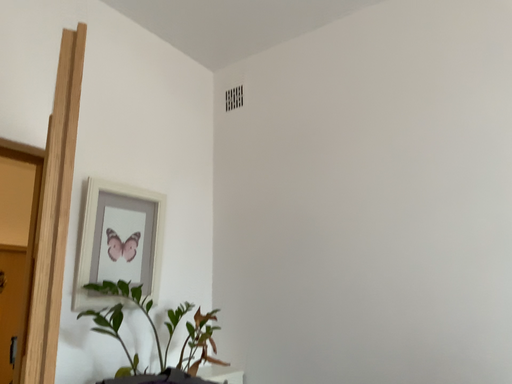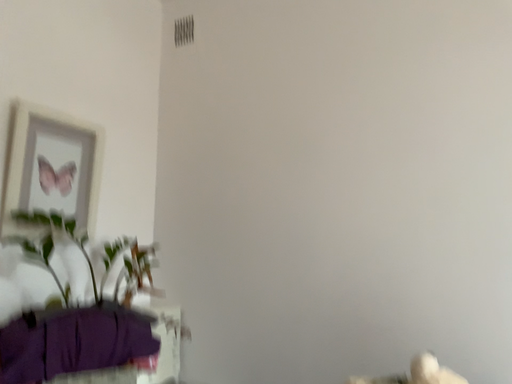
Question: Which way did the camera rotate in the video?

Choices:
 (A) rotated right
 (B) rotated left

Answer: (A)